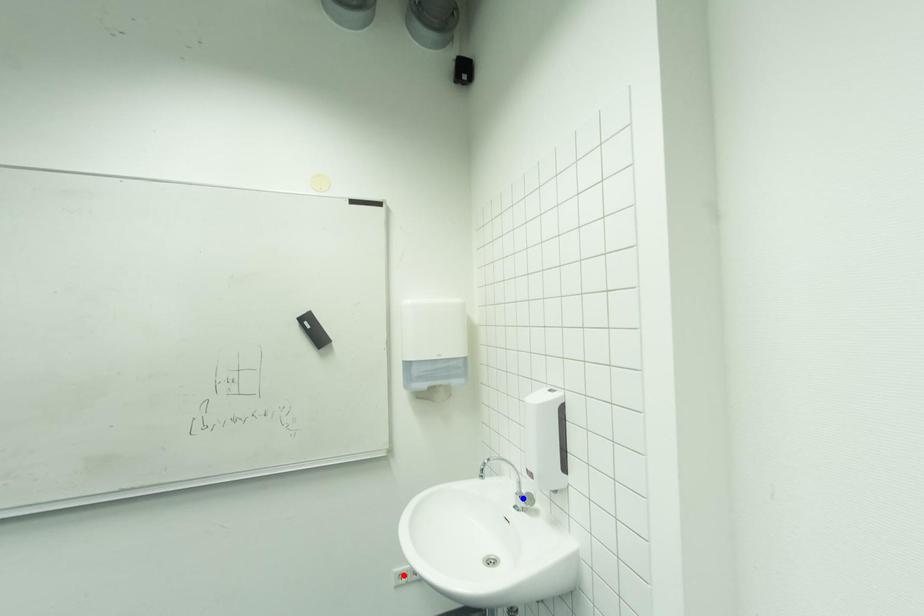
Question: In the image, two points are highlighted. Which point is nearer to the camera? Reply with the corresponding letter.

Choices:
 (A) blue point
 (B) red point

Answer: (A)